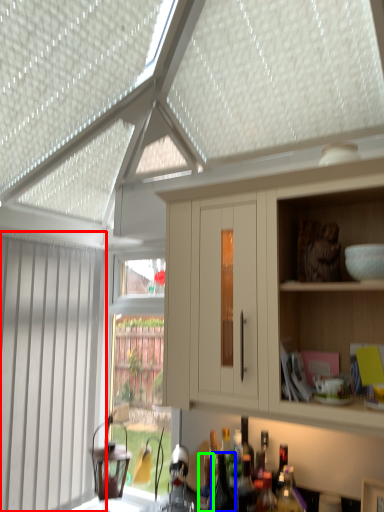
Question: Which object is the closest to the window (highlighted by a red box)? Choose among these: bottle (highlighted by a blue box) or bottle (highlighted by a green box).

Choices:
 (A) bottle
 (B) bottle

Answer: (B)